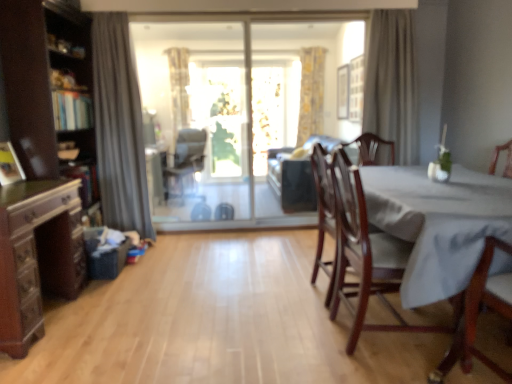
Question: Can you confirm if beige fabric curtain at upper right, the 1th curtain positioned from the right, is bigger than transparent glass sliding door at center, arranged as the 2th window screen when viewed from the back?

Choices:
 (A) no
 (B) yes

Answer: (A)

Question: From the image's perspective, would you say beige fabric curtain at upper right, the 2th curtain viewed from the front, is shown under transparent glass sliding door at center, arranged as the 2th window screen when viewed from the back?

Choices:
 (A) no
 (B) yes

Answer: (A)

Question: Considering the relative sizes of beige fabric curtain at upper right, acting as the 3th curtain starting from the left, and transparent glass sliding door at center, arranged as the 2th window screen when viewed from the back, in the image provided, is beige fabric curtain at upper right, acting as the 3th curtain starting from the left, thinner than transparent glass sliding door at center, arranged as the 2th window screen when viewed from the back,?

Choices:
 (A) yes
 (B) no

Answer: (B)

Question: Considering the relative sizes of beige fabric curtain at upper right, the 2th curtain viewed from the front, and transparent glass sliding door at center, arranged as the 2th window screen when viewed from the back, in the image provided, is beige fabric curtain at upper right, the 2th curtain viewed from the front, shorter than transparent glass sliding door at center, arranged as the 2th window screen when viewed from the back,?

Choices:
 (A) yes
 (B) no

Answer: (A)

Question: From a real-world perspective, is beige fabric curtain at upper right, the 1th curtain positioned from the right, positioned under transparent glass sliding door at center, arranged as the 2th window screen when viewed from the back, based on gravity?

Choices:
 (A) no
 (B) yes

Answer: (A)

Question: Does beige fabric curtain at upper right, acting as the 3th curtain starting from the left, have a smaller size compared to transparent glass sliding door at center, arranged as the 2th window screen when viewed from the back?

Choices:
 (A) no
 (B) yes

Answer: (B)

Question: Does matte black chair at center, placed as the third chair when sorted from right to left, come in front of suede-like brown couch at center?

Choices:
 (A) yes
 (B) no

Answer: (B)

Question: Considering the relative sizes of matte black chair at center, the first chair in the back-to-front sequence, and suede-like brown couch at center in the image provided, is matte black chair at center, the first chair in the back-to-front sequence, taller than suede-like brown couch at center?

Choices:
 (A) yes
 (B) no

Answer: (A)

Question: From the image's perspective, is matte black chair at center, which is the first chair in left-to-right order, on top of suede-like brown couch at center?

Choices:
 (A) no
 (B) yes

Answer: (B)

Question: Can we say matte black chair at center, which is the first chair in left-to-right order, lies outside suede-like brown couch at center?

Choices:
 (A) yes
 (B) no

Answer: (A)

Question: Can you confirm if matte black chair at center, which is the third chair from front to back, is bigger than suede-like brown couch at center?

Choices:
 (A) yes
 (B) no

Answer: (B)

Question: Considering the relative positions of matte black chair at center, placed as the third chair when sorted from right to left, and suede-like brown couch at center in the image provided, is matte black chair at center, placed as the third chair when sorted from right to left, to the right of suede-like brown couch at center from the viewer's perspective?

Choices:
 (A) no
 (B) yes

Answer: (A)

Question: Considering the relative positions of matte black chair at center, the first chair in the back-to-front sequence, and transparent glass screen door at center in the image provided, is matte black chair at center, the first chair in the back-to-front sequence, behind transparent glass screen door at center?

Choices:
 (A) yes
 (B) no

Answer: (A)